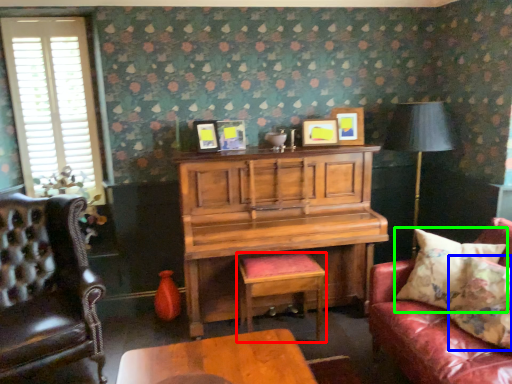
Question: Estimate the real-world distances between objects in this image. Which object is closer to stool (highlighted by a red box), pillow (highlighted by a blue box) or pillow (highlighted by a green box)?

Choices:
 (A) pillow
 (B) pillow

Answer: (B)